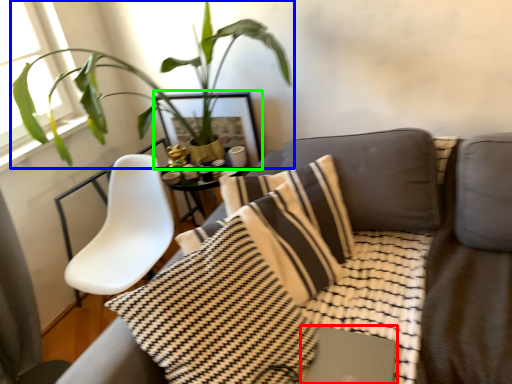
Question: Which object is positioned farthest from computer (highlighted by a red box)? Select from houseplant (highlighted by a blue box) and picture frame (highlighted by a green box).

Choices:
 (A) houseplant
 (B) picture frame

Answer: (A)